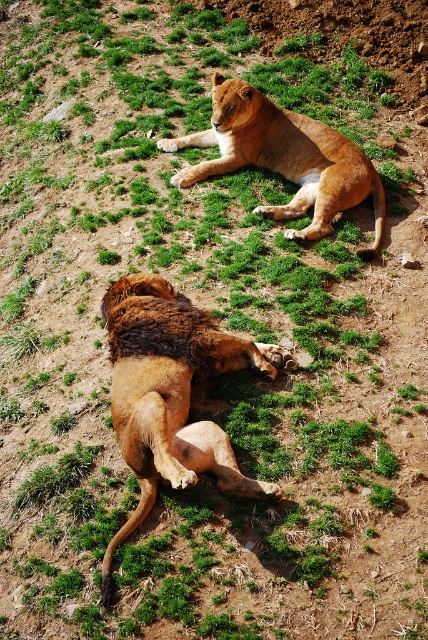
You are a wildlife photographer aiming to capture a closeup of the brown shaggy lion at lower left and the golden fur lion at upper center. Since your camera can only focus on one subject at a time, which lion should you focus on first to ensure the closest subject is in focus?

The brown shaggy lion at lower left is closer to the viewer than the golden fur lion at upper center, so you should focus on the brown shaggy lion at lower left first to ensure proper focus.

In the image of the lions resting on the grassy area, which lion is positioned to the left when observing the brown shaggy lion at lower left and the golden fur lion at upper center?

The brown shaggy lion at lower left is positioned to the left of the golden fur lion at upper center.

You are a wildlife photographer trying to capture a photo of both the brown shaggy lion at lower left and the golden fur lion at upper center. Since you want to ensure both lions are clearly visible in the frame, which lion should you focus on first to account for their sizes?

The brown shaggy lion at lower left has a greater height compared to the golden fur lion at upper center, so you should focus on the brown shaggy lion at lower left first because it is larger and requires more attention to ensure clarity in the photo.